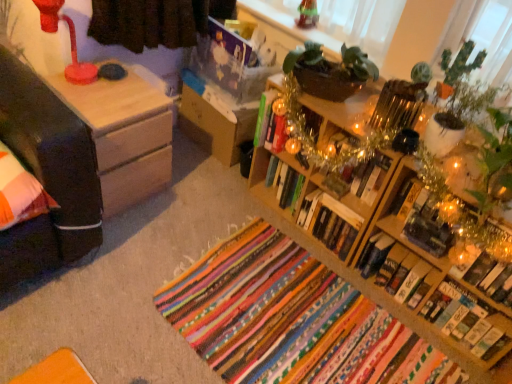
Where is `empty space that is in between wooden nightstand at left and multicolored woven rug at center`? empty space that is in between wooden nightstand at left and multicolored woven rug at center is located at coordinates (173, 225).